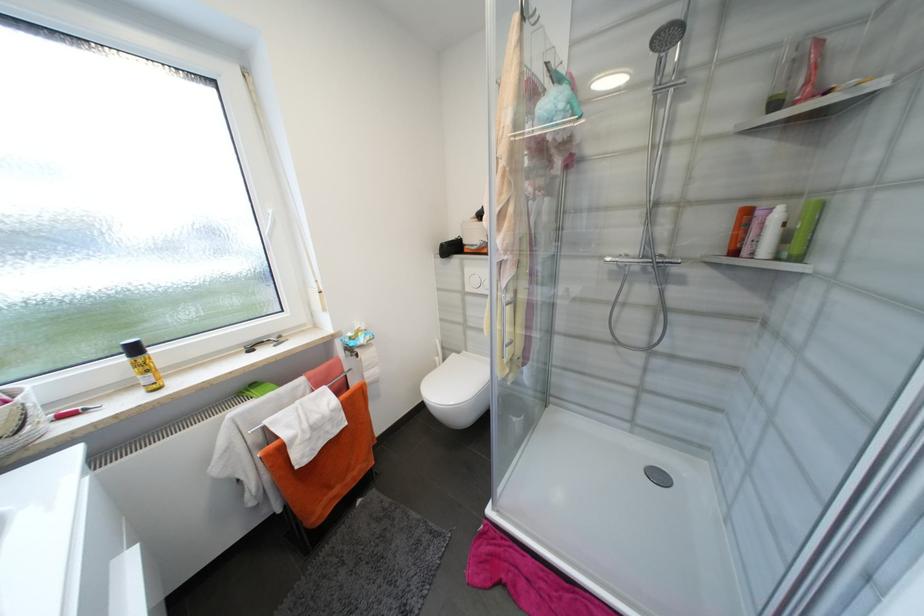
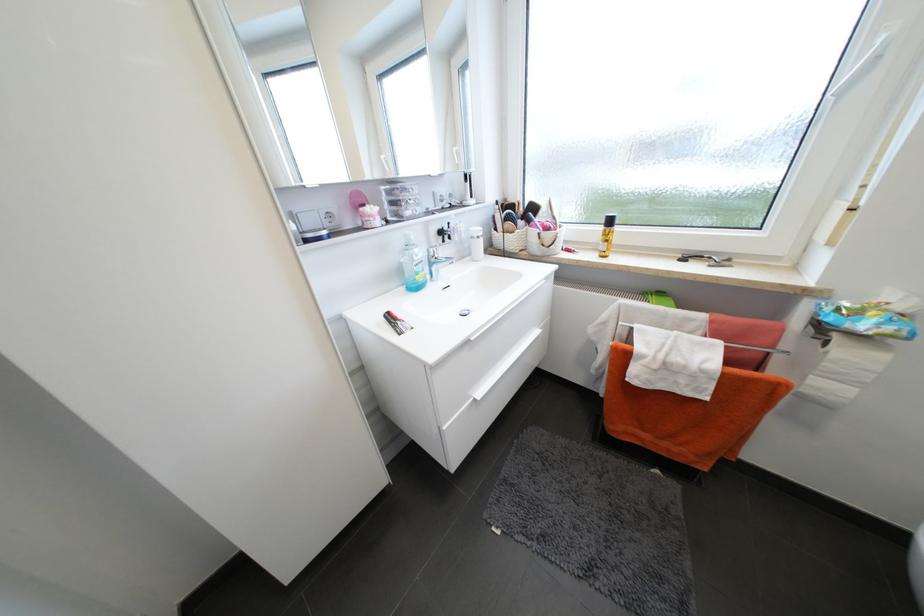
In the second image, find the point that corresponds to (275,213) in the first image.

(888, 41)